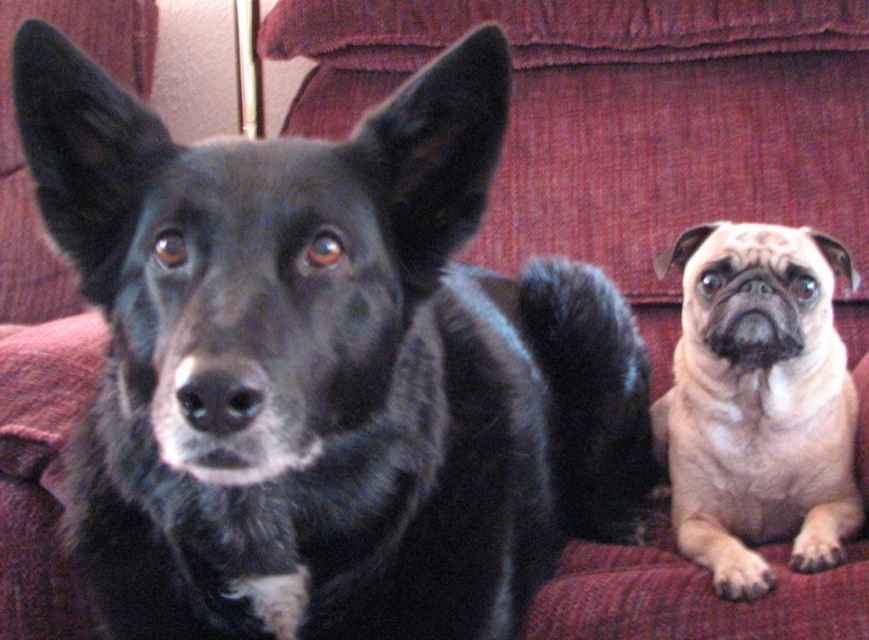
You are sitting on the couch and want to hand a treat to the black fur dog at center and the beige fur pug at right. Since you can only reach one at a time, which dog should you hand the treat to first if you want to avoid leaning too far?

The black fur dog at center is to the left of beige fur pug at right, so you should hand the treat to the black fur dog at center first since it is closer to your left side.

You are a dog trainer observing two dogs on a couch. You need to determine if a 1.2 meter wide blanket can fit between the black fur dog at center and the beige fur pug at right. Can you confirm if the space between them is wide enough?

The black fur dog at center might be wider than beige fur pug at right, so the space between them may not be sufficient to fit a 1.2 meter wide blanket. Further measurement is needed.

You are a dog groomer who needs to choose the appropriate size of grooming table for both dogs. The black fur dog at center and the beige fur pug at right are waiting on the couch. Which dog requires a larger grooming table?

The black fur dog at center requires a larger grooming table because it is bigger than the beige fur pug at right.